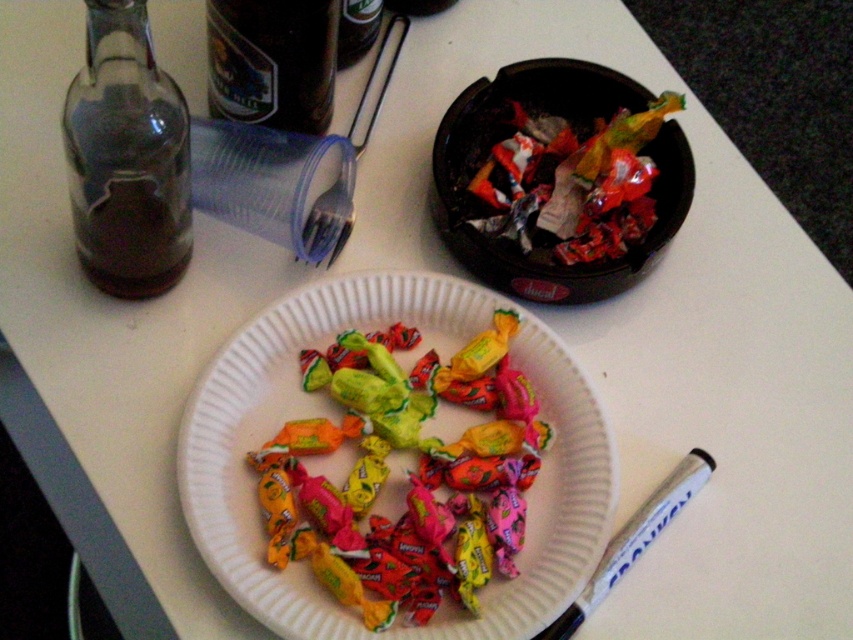
In the scene shown: You are looking at the white table with the candy plate and glass bottle. There are two points marked on the table. One is at coordinates point [235,376] and the other at point [630,188]. Which of these points is closer to you?

Point [235,376] is closer to the viewer than point [630,188].

You are a waiter at a party and need to place a new drink order on the table. The drink must be placed at least 8 inches away from the glossy paper plate at center to avoid spills. Can you place the drink near the shiny metallic foil at upper right?

The glossy paper plate at center is only 7.34 inches away from the shiny metallic foil at upper right, which is less than the required 8 inches. Therefore, placing the drink near the shiny metallic foil at upper right would not meet the safety distance requirement.

You are at a party and want to grab a candy from the glossy paper plate at center. However, there is a transparent glass bottle at left in the way. Can you reach the plate without moving the bottle?

The transparent glass bottle at left is behind the glossy paper plate at center, so you can reach the plate without moving the bottle because the bottle is not blocking the front of the plate.